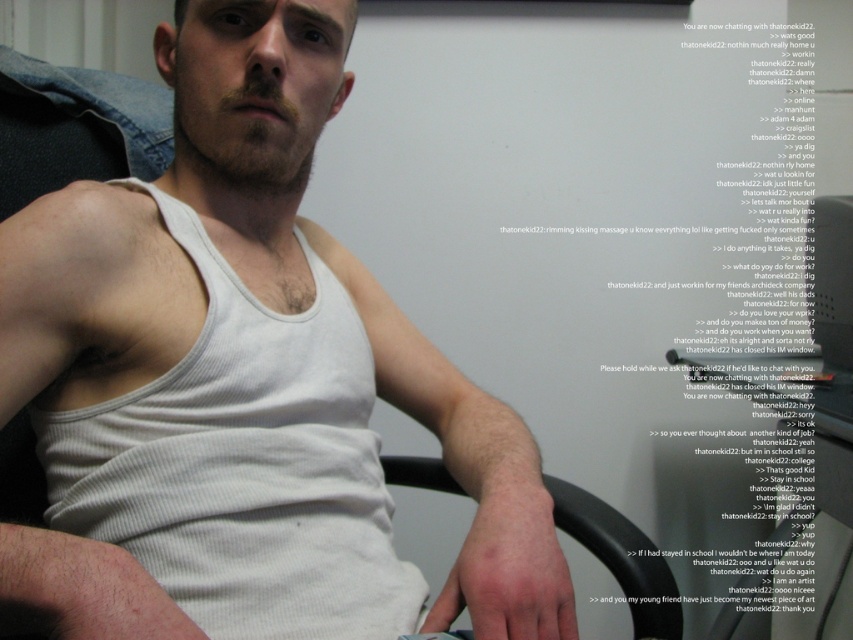
The width and height of the screenshot is (853, 640). What do you see at coordinates (350, 282) in the screenshot? I see `white ribbed tank top at center` at bounding box center [350, 282].

Is white ribbed tank top at center wider than black plastic chair at lower center?

Yes, white ribbed tank top at center is wider than black plastic chair at lower center.

Is point (80, 236) less distant than point (590, 538)?

That is True.

Locate an element on the screen. The image size is (853, 640). white ribbed tank top at center is located at coordinates (350, 282).